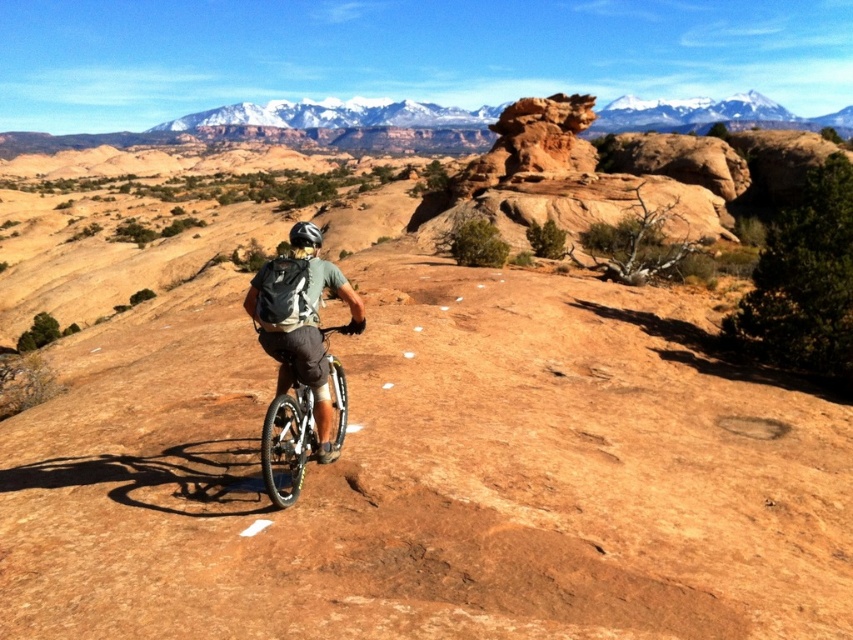
Question: Is matte gray backpack at center below silver metallic bicycle at center?

Choices:
 (A) no
 (B) yes

Answer: (A)

Question: Can you confirm if matte gray backpack at center is thinner than silver metallic bicycle at center?

Choices:
 (A) yes
 (B) no

Answer: (B)

Question: Which point appears farthest from the camera in this image?

Choices:
 (A) (292, 234)
 (B) (271, 486)

Answer: (A)

Question: Which point is farther to the camera?

Choices:
 (A) (305, 444)
 (B) (297, 230)

Answer: (A)

Question: Observing the image, what is the correct spatial positioning of silver metallic bicycle at center in reference to black matte bicycle helmet at center?

Choices:
 (A) below
 (B) above

Answer: (A)

Question: Which object is farther from the camera taking this photo?

Choices:
 (A) silver metallic bicycle at center
 (B) matte gray backpack at center

Answer: (B)